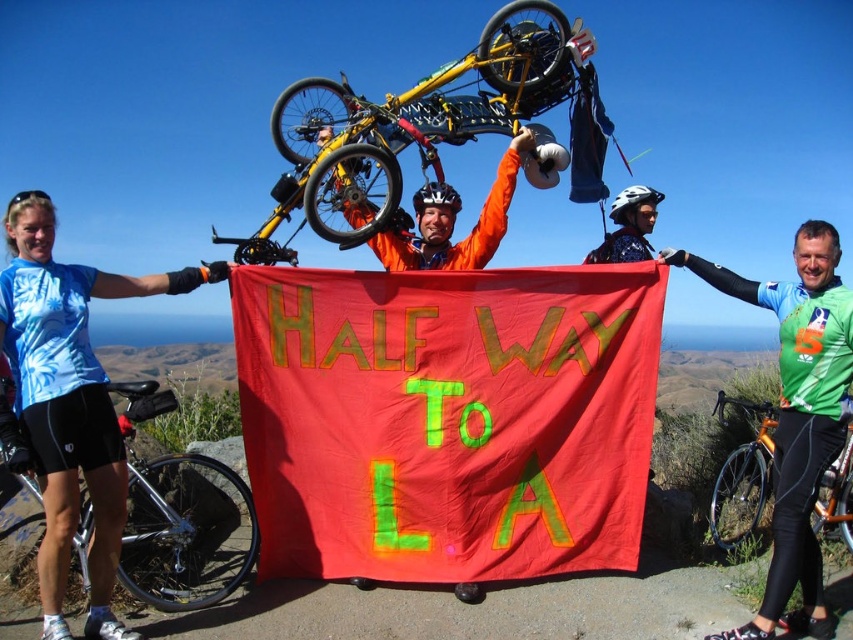
Can you confirm if orange matte bicycle at center is wider than matte orange helmet at center?

Correct, the width of orange matte bicycle at center exceeds that of matte orange helmet at center.

Does point (434, 262) come closer to viewer compared to point (456, 195)?

Yes, it is.

This screenshot has width=853, height=640. What are the coordinates of `orange matte bicycle at center` in the screenshot? It's located at (454, 221).

Does shiny silver bicycle at lower left appear under smooth skin head at upper right?

Yes.

Describe the element at coordinates (186, 531) in the screenshot. The height and width of the screenshot is (640, 853). I see `shiny silver bicycle at lower left` at that location.

Find the location of `shiny silver bicycle at lower left`. shiny silver bicycle at lower left is located at coordinates (186, 531).

Between red fabric banner at center and orange matte bicycle at center, which one has less height?

Standing shorter between the two is orange matte bicycle at center.

Measure the distance between point (624, 538) and camera.

Point (624, 538) is 6.30 meters away from camera.

Does point (434, 540) come farther from viewer compared to point (442, 188)?

No, it is in front of (442, 188).

Identify the location of red fabric banner at center. The image size is (853, 640). (447, 419).